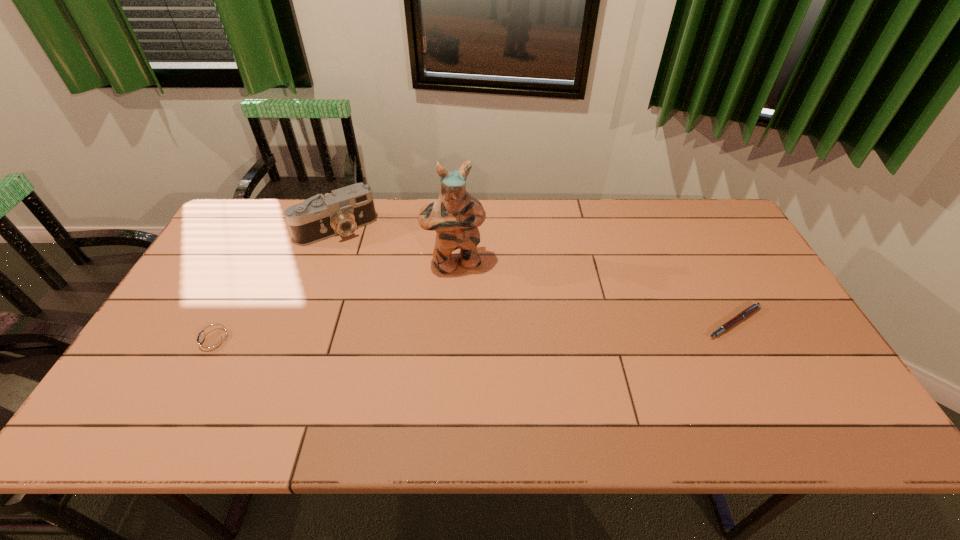
I want to click on vacant space located on the lens of the camera, so click(x=396, y=315).

The image size is (960, 540). I want to click on free location located 0.160m on the lens of the camera, so click(x=371, y=274).

What are the coordinates of `vacant space located on the lens of the camera` in the screenshot? It's located at (367, 267).

Locate an element on the screen. blank area located on the front-facing side of the second object from right to left is located at coordinates pyautogui.click(x=473, y=308).

Find the location of `vacant space located 0.380m on the front-facing side of the second object from right to left`. vacant space located 0.380m on the front-facing side of the second object from right to left is located at coordinates (500, 386).

Where is `vacant position located on the front-facing side of the second object from right to left`? The image size is (960, 540). vacant position located on the front-facing side of the second object from right to left is located at coordinates (492, 361).

Locate an element on the screen. object at the far edge is located at coordinates (341, 212).

Image resolution: width=960 pixels, height=540 pixels. I want to click on object situated at the left edge, so click(212, 342).

Locate an element on the screen. object at the right edge is located at coordinates (754, 307).

Find the location of `vacant space at the far edge`. vacant space at the far edge is located at coordinates (388, 202).